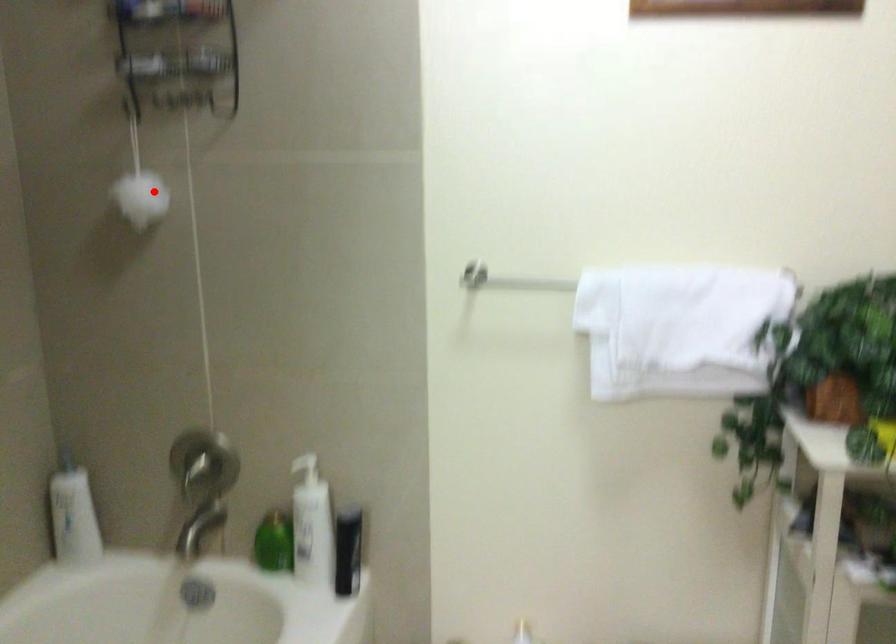
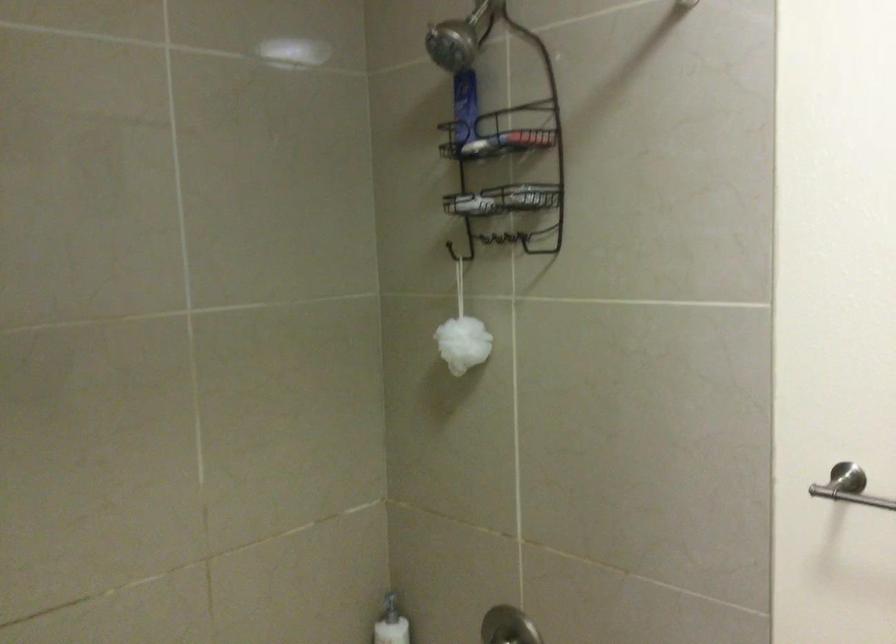
Where in the second image is the point corresponding to the highlighted location from the first image?

(462, 343)